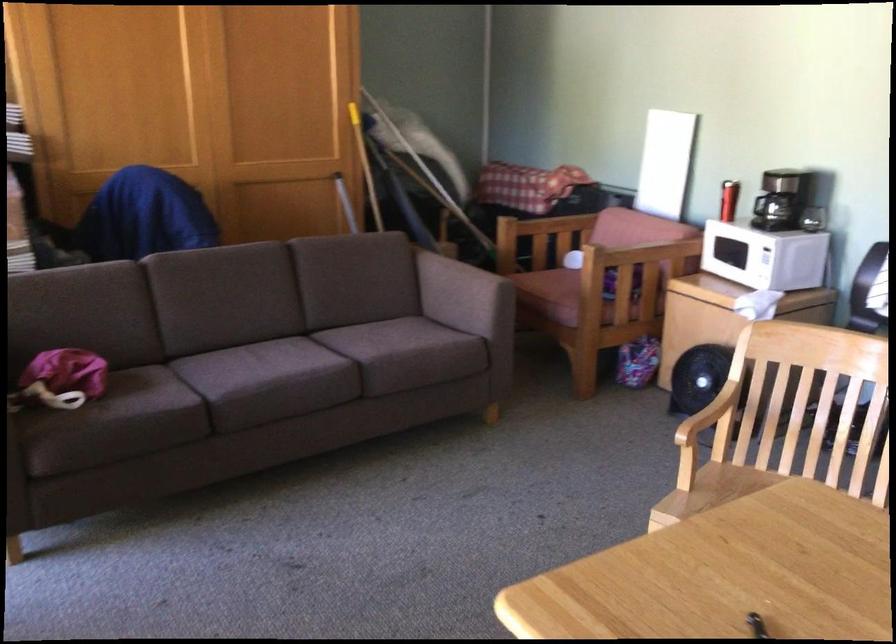
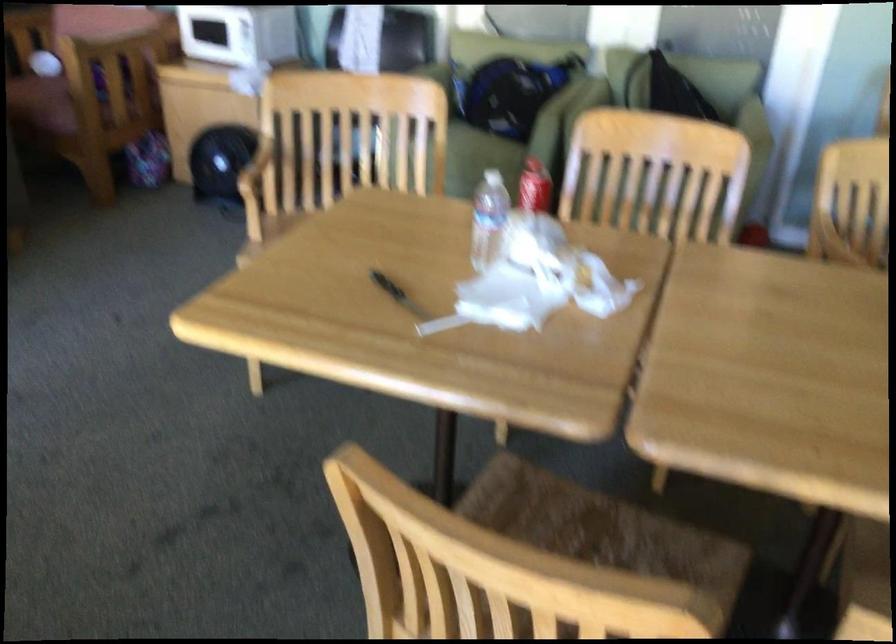
In the second image, find the point that corresponds to [702,410] in the first image.

(255, 166)